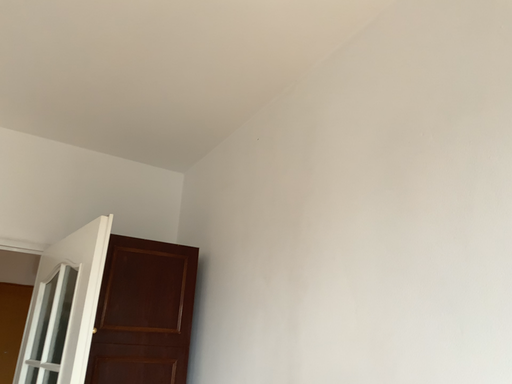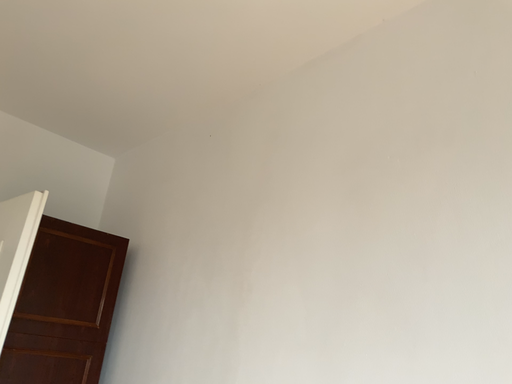
Question: How did the camera likely rotate when shooting the video?

Choices:
 (A) rotated left
 (B) rotated right

Answer: (B)